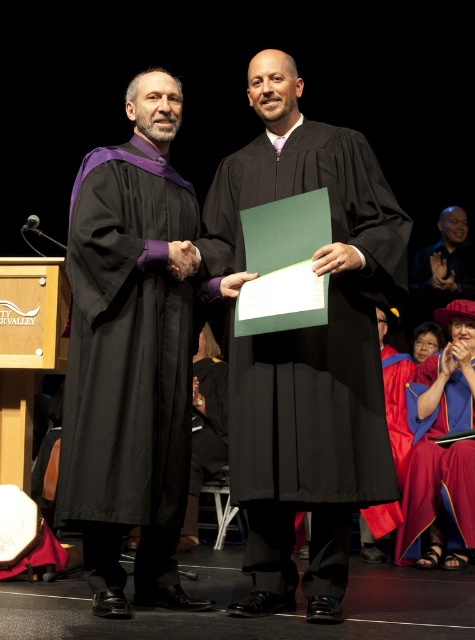
Between matte black gown at center and black matte graduation gown at center, which one appears on the left side from the viewer's perspective?

Positioned to the left is black matte graduation gown at center.

Can you confirm if matte black gown at center is bigger than black matte graduation gown at center?

Yes, matte black gown at center is bigger than black matte graduation gown at center.

The height and width of the screenshot is (640, 475). What do you see at coordinates (307, 349) in the screenshot?
I see `matte black gown at center` at bounding box center [307, 349].

What are the coordinates of `matte black gown at center` in the screenshot? It's located at (307, 349).

The image size is (475, 640). Describe the element at coordinates (307, 349) in the screenshot. I see `matte black gown at center` at that location.

Does matte black gown at center appear on the left side of velvet maroon gown at lower right?

Indeed, matte black gown at center is positioned on the left side of velvet maroon gown at lower right.

Which is behind, point (323, 392) or point (428, 490)?

The point (428, 490) is more distant.

This screenshot has width=475, height=640. In order to click on matte black gown at center in this screenshot , I will do `click(307, 349)`.

The image size is (475, 640). Describe the element at coordinates (443, 266) in the screenshot. I see `bald head at center` at that location.

Who is shorter, bald head at center or velvet red graduation gown at lower right?

bald head at center

Who is more forward, (468,264) or (401,477)?

Positioned in front is point (401,477).

Locate an element on the screen. bald head at center is located at coordinates (443, 266).